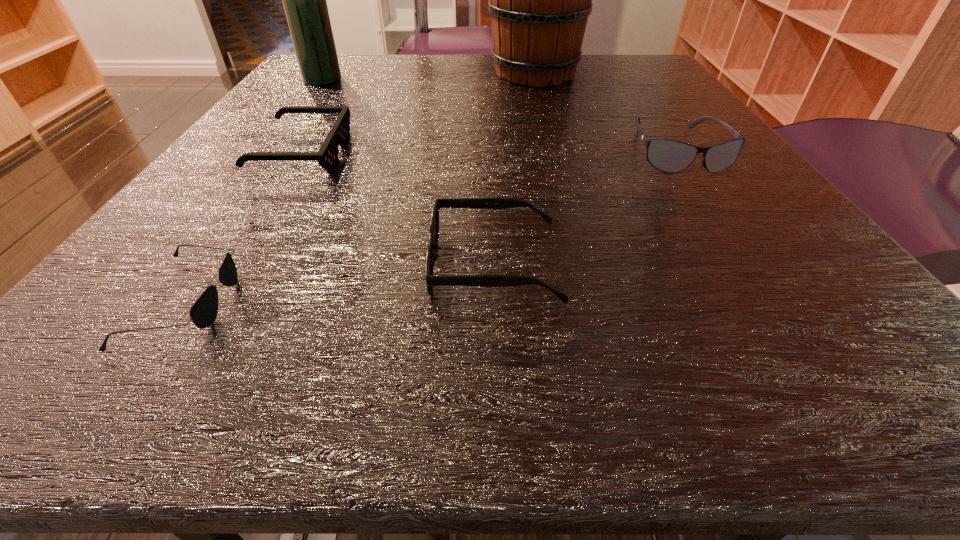
Identify the location of empty space that is in between the shortest object and the wine bucket. (360, 187).

You are a GUI agent. You are given a task and a screenshot of the screen. Output one action in this format:
    pyautogui.click(x=<x>, y=<y>)
    Task: Click on the free point between the shortest object and the wine bucket
    
    Given the screenshot: What is the action you would take?
    pyautogui.click(x=360, y=187)

Find the location of a particular element. free space between the shortest object and the wine bucket is located at coordinates (360, 187).

Find the location of a particular element. the second closest object to the wine bucket is located at coordinates (327, 156).

Locate which object is the third closest to the third sunglasses from left to right. Please provide its 2D coordinates. Your answer should be formatted as a tuple, i.e. [(x, y)], where the tuple contains the x and y coordinates of a point satisfying the conditions above.

[(203, 313)]

The width and height of the screenshot is (960, 540). In order to click on sunglasses that can be found as the fourth closest to the alcohol in this screenshot , I will do `click(667, 155)`.

Find the location of `sunglasses object that ranks as the closest to the shortest sunglasses`. sunglasses object that ranks as the closest to the shortest sunglasses is located at coordinates (327, 156).

Where is `free spot that satisfies the following two spatial constraints: 1. on the front side of the wine bucket; 2. on the lenses of the shortest sunglasses`? The height and width of the screenshot is (540, 960). free spot that satisfies the following two spatial constraints: 1. on the front side of the wine bucket; 2. on the lenses of the shortest sunglasses is located at coordinates (595, 301).